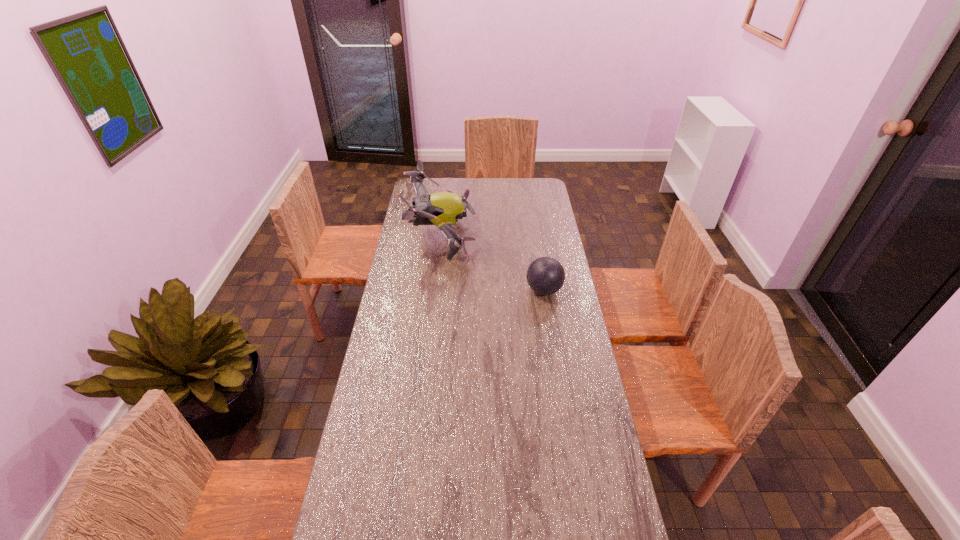
The image size is (960, 540). Find the location of `blank space at the far edge of the desktop`. blank space at the far edge of the desktop is located at coordinates (499, 183).

This screenshot has height=540, width=960. I want to click on vacant space at the left edge of the desktop, so click(356, 432).

You are a GUI agent. You are given a task and a screenshot of the screen. Output one action in this format:
    pyautogui.click(x=<x>, y=<y>)
    Task: Click on the free space at the right edge
    
    Given the screenshot: What is the action you would take?
    pyautogui.click(x=544, y=218)

In the image, there is a desktop. Where is `vacant area at the far right corner`? The width and height of the screenshot is (960, 540). vacant area at the far right corner is located at coordinates (535, 180).